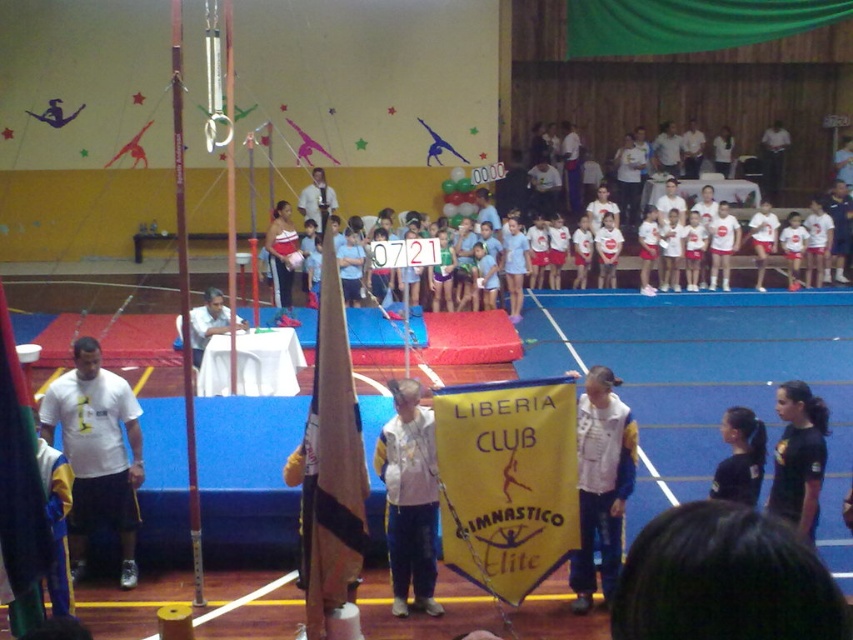
You are standing at the entrance of the gymnasium and want to walk towards the point labeled as point (347, 534). As you move forward, will you first pass by point (421, 483) before reaching your destination?

No, because point (347, 534) is in front of point (421, 483), so you would reach point (347, 534) before passing point (421, 483).

You are standing at point point [318,465] and want to take a photo of the gymnasts on the blue mat area. The camera you are using has a maximum focus range of 15 feet. Will the camera be able to focus on the gymnasts?

The distance between point [318,465] and the camera is 17.41 feet, which exceeds the camera maximum focus range of 15 feet. Therefore, the camera will not be able to focus on the gymnasts.